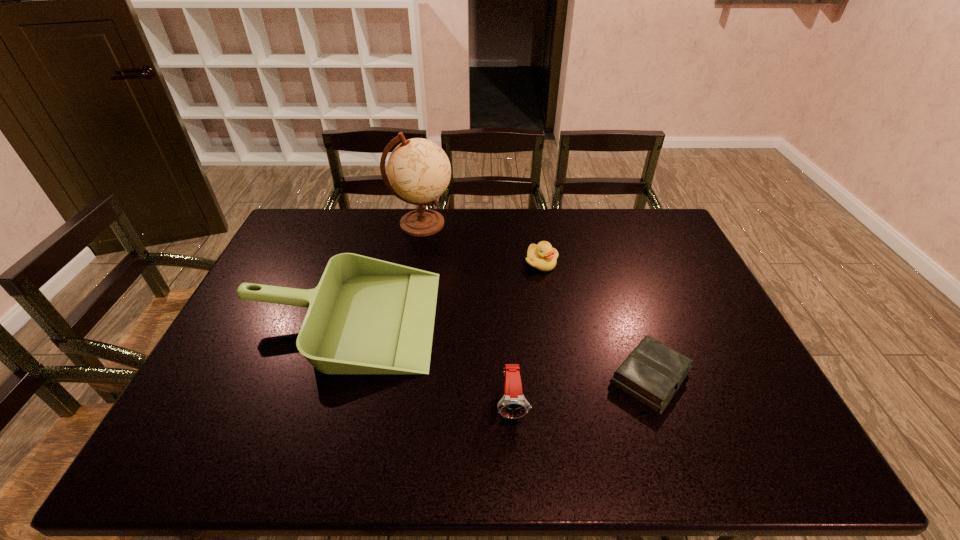
Locate an element on the screen. Image resolution: width=960 pixels, height=540 pixels. vacant region located on the face of the third object from left to right is located at coordinates (516, 454).

This screenshot has width=960, height=540. I want to click on vacant space located 0.340m on the beak of the second object from right to left, so click(x=557, y=356).

Locate an element on the screen. This screenshot has height=540, width=960. vacant space located 0.150m on the back of the shortest object is located at coordinates (625, 305).

What are the coordinates of `object positioned at the far edge` in the screenshot? It's located at (419, 171).

This screenshot has height=540, width=960. I want to click on object that is at the left edge, so click(366, 316).

Identify the location of free space at the far edge. The height and width of the screenshot is (540, 960). (475, 215).

In order to click on free point at the near edge in this screenshot , I will do `click(603, 468)`.

In the image, there is a desktop. Identify the location of free space at the left edge. This screenshot has height=540, width=960. (276, 273).

The width and height of the screenshot is (960, 540). I want to click on free space at the right edge of the desktop, so click(684, 269).

Where is `free spot at the far left corner of the desktop`? free spot at the far left corner of the desktop is located at coordinates (337, 209).